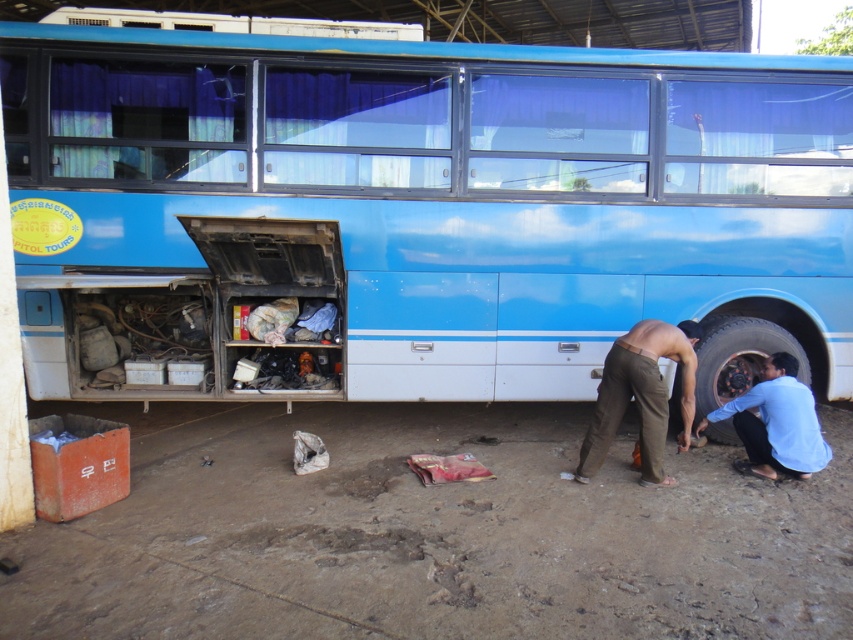
Question: Is blue matte bus at center to the right of brown cotton pants at lower center from the viewer's perspective?

Choices:
 (A) no
 (B) yes

Answer: (A)

Question: Does brown cotton pants at lower center have a larger size compared to blue cotton shirt at lower right?

Choices:
 (A) yes
 (B) no

Answer: (A)

Question: Estimate the real-world distances between objects in this image. Which object is farther from the blue matte bus at center?

Choices:
 (A) blue cotton shirt at lower right
 (B) brown cotton pants at lower center
 (C) rustic metal tire at lower right

Answer: (A)

Question: Which point is farther from the camera taking this photo?

Choices:
 (A) (776, 108)
 (B) (753, 336)
 (C) (793, 426)
 (D) (648, 365)

Answer: (B)

Question: Can you confirm if blue cotton shirt at lower right is thinner than rustic metal tire at lower right?

Choices:
 (A) yes
 (B) no

Answer: (A)

Question: Which point is closer to the camera taking this photo?

Choices:
 (A) (786, 435)
 (B) (722, 403)
 (C) (664, 141)

Answer: (A)